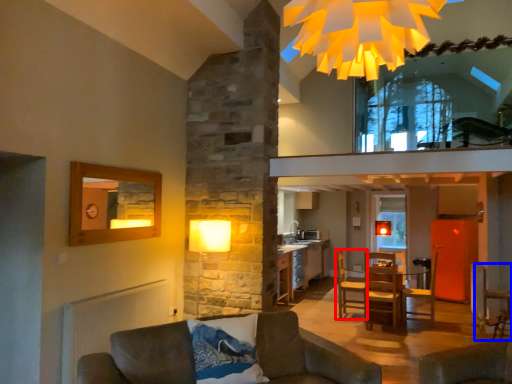
Question: Among these objects, which one is nearest to the camera, armchair (highlighted by a red box) or armchair (highlighted by a blue box)?

Choices:
 (A) armchair
 (B) armchair

Answer: (B)